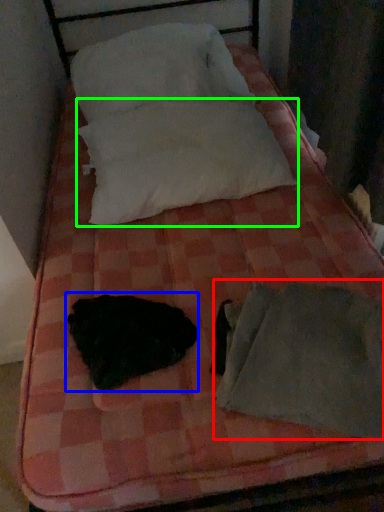
Question: Which object is positioned closest to sleeping bag (highlighted by a red box)? Select from animal (highlighted by a blue box) and pillow (highlighted by a green box).

Choices:
 (A) animal
 (B) pillow

Answer: (A)